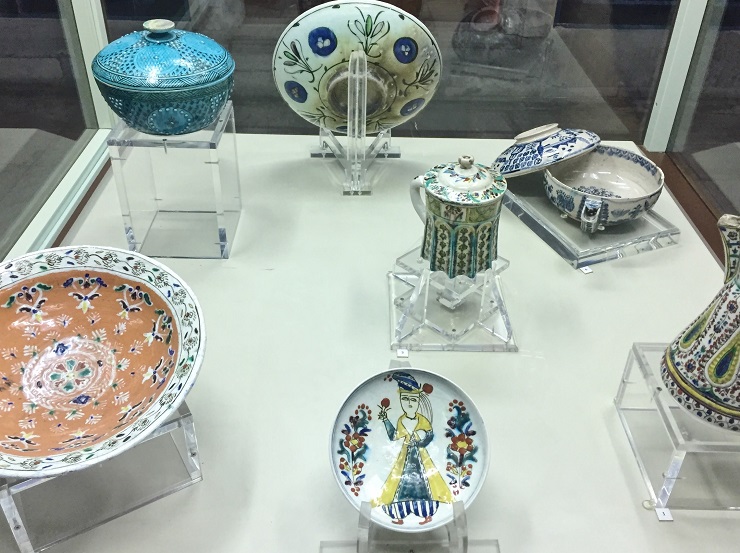
Where is `bowl`? The height and width of the screenshot is (553, 740). bowl is located at coordinates (391, 49).